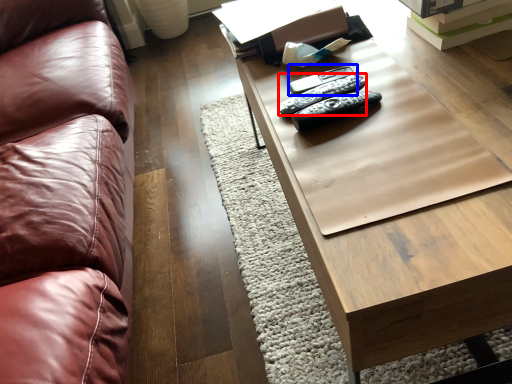
Question: Which of the following is the farthest to the observer, remote (highlighted by a red box) or remote (highlighted by a blue box)?

Choices:
 (A) remote
 (B) remote

Answer: (B)